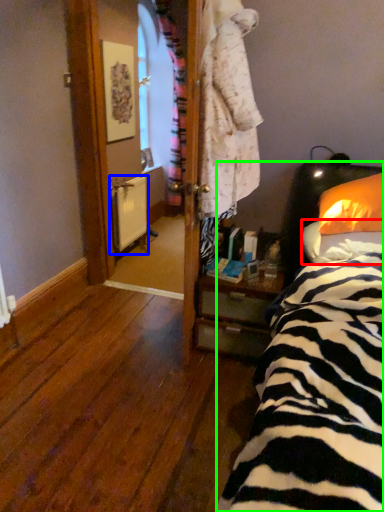
Question: Which object is positioned farthest from pillow (highlighted by a red box)? Select from radiator (highlighted by a blue box) and bed (highlighted by a green box).

Choices:
 (A) radiator
 (B) bed

Answer: (A)